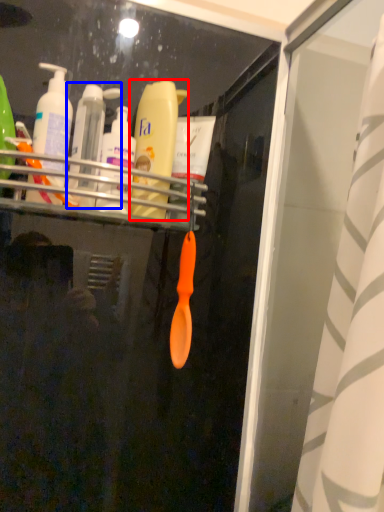
Question: Which of the following is the closest to the observer, bottle (highlighted by a red box) or toiletry (highlighted by a blue box)?

Choices:
 (A) bottle
 (B) toiletry

Answer: (B)